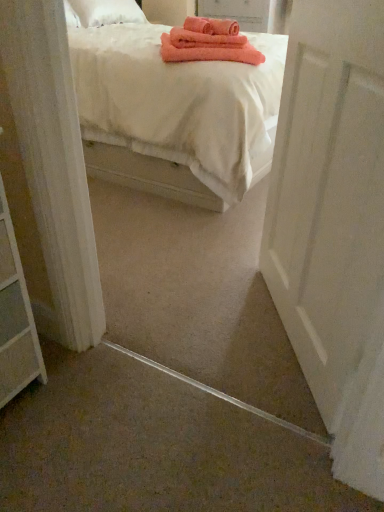
Question: Is white matte door at right wider or thinner than white cotton bed at upper center?

Choices:
 (A) thin
 (B) wide

Answer: (A)

Question: From their relative heights in the image, would you say white matte door at right is taller or shorter than white cotton bed at upper center?

Choices:
 (A) tall
 (B) short

Answer: (A)

Question: Looking at the image, does white matte door at right seem bigger or smaller compared to white cotton bed at upper center?

Choices:
 (A) small
 (B) big

Answer: (A)

Question: Does point (238, 160) appear closer or farther from the camera than point (362, 287)?

Choices:
 (A) farther
 (B) closer

Answer: (A)

Question: In terms of height, does white cotton bed at upper center look taller or shorter compared to white matte door at right?

Choices:
 (A) short
 (B) tall

Answer: (A)

Question: Considering the relative positions of white cotton bed at upper center and white matte door at right in the image provided, is white cotton bed at upper center to the left or to the right of white matte door at right?

Choices:
 (A) right
 (B) left

Answer: (B)

Question: Considering the positions of white cotton bed at upper center and white matte door at right in the image, is white cotton bed at upper center wider or thinner than white matte door at right?

Choices:
 (A) wide
 (B) thin

Answer: (A)